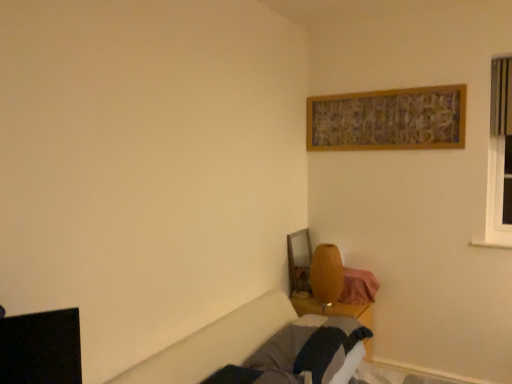
This screenshot has width=512, height=384. What do you see at coordinates (298, 353) in the screenshot?
I see `wooden bed frame at lower right` at bounding box center [298, 353].

What are the coordinates of `wooden bed frame at lower right` in the screenshot? It's located at (298, 353).

From the picture: Measure the distance between point [313,274] and camera.

Point [313,274] is 9.28 feet away from camera.

At what (x,y) coordinates should I click in order to perform the action: click on matte yellow vase at lower center. Please return your answer as a coordinate pair (x, y). Image resolution: width=512 pixels, height=384 pixels. Looking at the image, I should click on (326, 274).

Describe the element at coordinates (326, 274) in the screenshot. This screenshot has width=512, height=384. I see `matte yellow vase at lower center` at that location.

In order to click on wooden bed frame at lower right in this screenshot , I will do `click(298, 353)`.

Is wooden bed frame at lower right to the left or to the right of matte yellow vase at lower center in the image?

wooden bed frame at lower right is positioned on matte yellow vase at lower center's left side.

Relative to matte yellow vase at lower center, is wooden bed frame at lower right in front or behind?

wooden bed frame at lower right is in front of matte yellow vase at lower center.

Which is in front, point (318, 347) or point (336, 298)?

Positioned in front is point (318, 347).

From the image's perspective, is wooden bed frame at lower right on matte yellow vase at lower center?

No.

From a real-world perspective, is wooden bed frame at lower right on matte yellow vase at lower center?

No.

Considering the sizes of objects wooden bed frame at lower right and matte yellow vase at lower center in the image provided, who is thinner, wooden bed frame at lower right or matte yellow vase at lower center?

With smaller width is matte yellow vase at lower center.

Between wooden bed frame at lower right and matte yellow vase at lower center, which one has less height?

wooden bed frame at lower right.

Who is bigger, wooden bed frame at lower right or matte yellow vase at lower center?

With larger size is wooden bed frame at lower right.

Is wooden bed frame at lower right inside the boundaries of matte yellow vase at lower center, or outside?

wooden bed frame at lower right cannot be found inside matte yellow vase at lower center.

Is wooden bed frame at lower right not near matte yellow vase at lower center?

No, wooden bed frame at lower right is in close proximity to matte yellow vase at lower center.

Could you tell me if wooden bed frame at lower right is turned towards matte yellow vase at lower center?

No, wooden bed frame at lower right is not facing towards matte yellow vase at lower center.

Locate an element on the screen. Image resolution: width=512 pixels, height=384 pixels. bed frame beneath the matte yellow vase at lower center (from a real-world perspective) is located at coordinates (298, 353).

Between matte yellow vase at lower center and wooden bed frame at lower right, which one appears on the right side from the viewer's perspective?

A: matte yellow vase at lower center is more to the right.

Which object is closer to the camera, matte yellow vase at lower center or wooden bed frame at lower right?

wooden bed frame at lower right is in front.

Is point (322, 265) positioned behind point (259, 358)?

Yes, it is.

From the image's perspective, between matte yellow vase at lower center and wooden bed frame at lower right, who is located below?

wooden bed frame at lower right, from the image's perspective.

From a real-world perspective, which is physically below, matte yellow vase at lower center or wooden bed frame at lower right?

In real-world perspective, wooden bed frame at lower right is lower.

Between matte yellow vase at lower center and wooden bed frame at lower right, which one has smaller width?

Result: Thinner between the two is matte yellow vase at lower center.

From their relative heights in the image, would you say matte yellow vase at lower center is taller or shorter than wooden bed frame at lower right?

matte yellow vase at lower center is taller than wooden bed frame at lower right.

Looking at the image, does matte yellow vase at lower center seem bigger or smaller compared to wooden bed frame at lower right?

In the image, matte yellow vase at lower center appears to be smaller than wooden bed frame at lower right.

Does matte yellow vase at lower center contain wooden bed frame at lower right?

Definitely not — wooden bed frame at lower right is not inside matte yellow vase at lower center.

Is matte yellow vase at lower center in contact with wooden bed frame at lower right?

No, matte yellow vase at lower center is not beside wooden bed frame at lower right.

Is matte yellow vase at lower center facing away from wooden bed frame at lower right?

That's not correct — matte yellow vase at lower center is not looking away from wooden bed frame at lower right.

At what (x,y) coordinates should I click in order to perform the action: click on bed frame below the matte yellow vase at lower center (from a real-world perspective). Please return your answer as a coordinate pair (x, y). Looking at the image, I should click on (298, 353).

Locate an element on the screen. Image resolution: width=512 pixels, height=384 pixels. table lamp above the wooden bed frame at lower right (from the image's perspective) is located at coordinates (326, 274).

The height and width of the screenshot is (384, 512). What are the coordinates of `table lamp behind the wooden bed frame at lower right` in the screenshot? It's located at (326, 274).